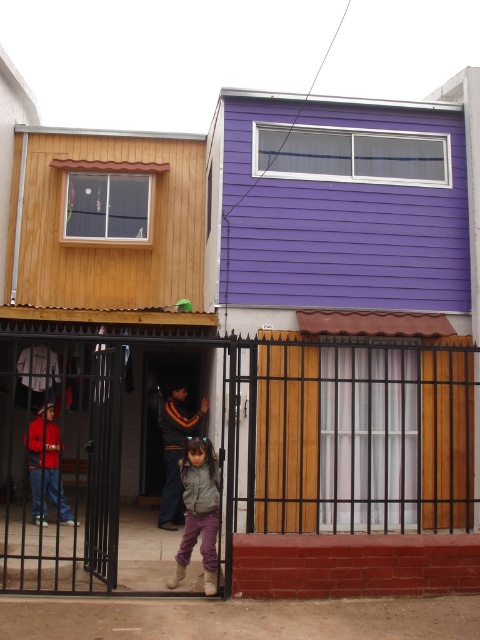
You are a delivery person arriving at the two houses. You see the wooden door at center and the gray woolen sweater at center. Which object is closer to you?

The wooden door at center is closer to you because the gray woolen sweater at center is behind it.